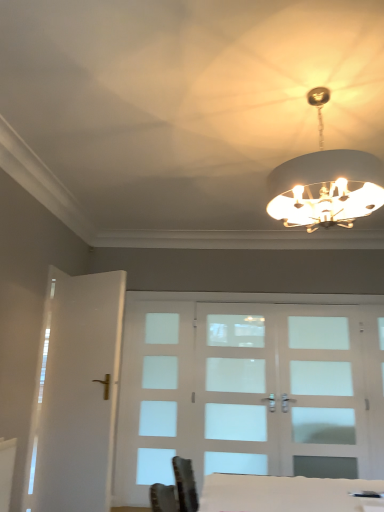
Question: Is white glass chandelier at upper center oriented towards white glossy table at lower center?

Choices:
 (A) no
 (B) yes

Answer: (A)

Question: Is white glass chandelier at upper center at the left side of white glossy table at lower center?

Choices:
 (A) no
 (B) yes

Answer: (A)

Question: Considering the relative sizes of white glass chandelier at upper center and white glossy table at lower center in the image provided, is white glass chandelier at upper center smaller than white glossy table at lower center?

Choices:
 (A) yes
 (B) no

Answer: (B)

Question: Is white glossy table at lower center at the back of white glass chandelier at upper center?

Choices:
 (A) no
 (B) yes

Answer: (A)

Question: Is white glass chandelier at upper center beside white glossy table at lower center?

Choices:
 (A) yes
 (B) no

Answer: (B)

Question: Does white glass chandelier at upper center have a lesser height compared to white glossy table at lower center?

Choices:
 (A) yes
 (B) no

Answer: (B)

Question: From the image's perspective, is white glossy table at lower center over white glass chandelier at upper center?

Choices:
 (A) no
 (B) yes

Answer: (A)

Question: Can you confirm if white glossy table at lower center is positioned to the right of white glass chandelier at upper center?

Choices:
 (A) yes
 (B) no

Answer: (B)

Question: Is white glossy table at lower center looking in the opposite direction of white glass chandelier at upper center?

Choices:
 (A) no
 (B) yes

Answer: (A)

Question: Does white glossy table at lower center contain white glass chandelier at upper center?

Choices:
 (A) yes
 (B) no

Answer: (B)

Question: From the image's perspective, is white glossy table at lower center beneath white glass chandelier at upper center?

Choices:
 (A) yes
 (B) no

Answer: (A)

Question: Can you confirm if white glossy table at lower center is taller than white glass chandelier at upper center?

Choices:
 (A) yes
 (B) no

Answer: (B)

Question: Can you confirm if clear glass door at center, which is the second screen door from right to left, is wider than white glossy table at lower center?

Choices:
 (A) no
 (B) yes

Answer: (A)